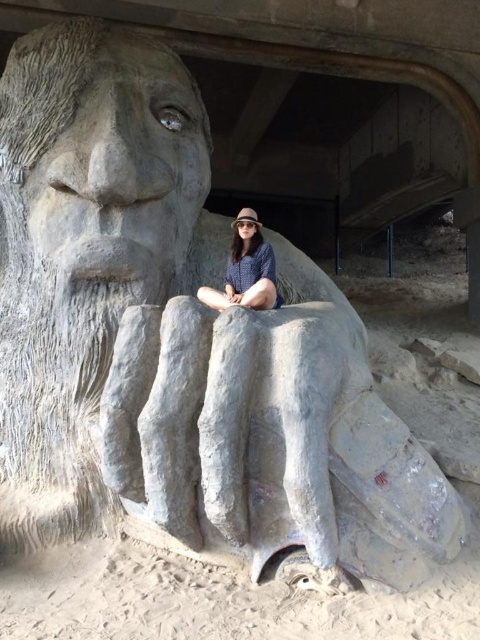
Measure the distance between gray stone head at upper left and matte gray stone statue at lower center.

gray stone head at upper left is 52.16 centimeters away from matte gray stone statue at lower center.

In the scene shown: Is gray stone head at upper left bigger than matte gray stone statue at lower center?

Yes.

This screenshot has height=640, width=480. Describe the element at coordinates (105, 154) in the screenshot. I see `gray stone head at upper left` at that location.

This screenshot has height=640, width=480. Find the location of `gray stone head at upper left`. gray stone head at upper left is located at coordinates (105, 154).